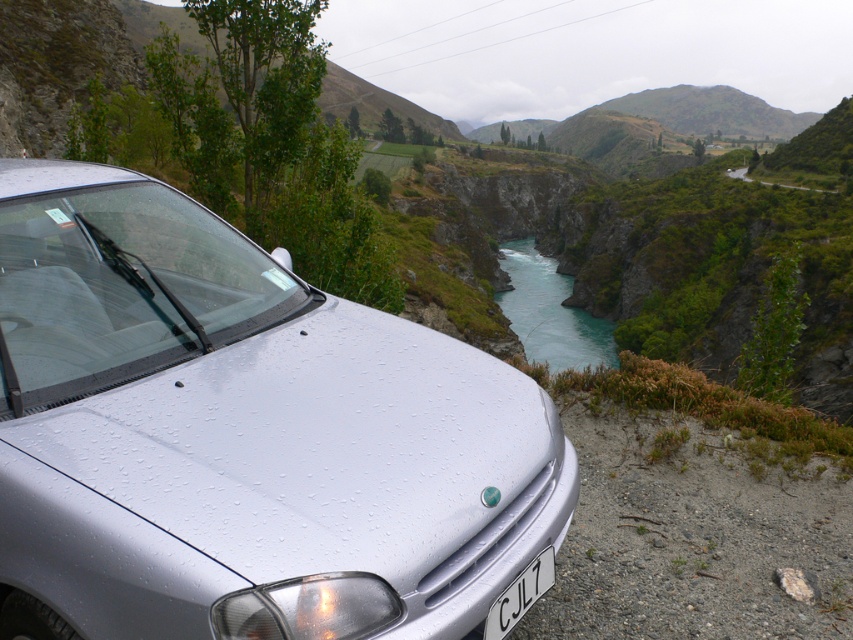
Question: Estimate the real-world distances between objects in this image. Which object is farther from the black plastic license plate at bottom center?

Choices:
 (A) satin silver car at center
 (B) turquoise smooth water at center

Answer: (B)

Question: Can you confirm if satin silver car at center is thinner than turquoise smooth water at center?

Choices:
 (A) no
 (B) yes

Answer: (B)

Question: Which object appears farthest from the camera in this image?

Choices:
 (A) black plastic license plate at bottom center
 (B) satin silver car at center

Answer: (A)

Question: Is satin silver car at center to the left of turquoise smooth water at center from the viewer's perspective?

Choices:
 (A) no
 (B) yes

Answer: (B)

Question: Which of these objects is positioned closest to the satin silver car at center?

Choices:
 (A) turquoise smooth water at center
 (B) black plastic license plate at bottom center

Answer: (B)

Question: Does satin silver car at center have a greater width compared to turquoise smooth water at center?

Choices:
 (A) yes
 (B) no

Answer: (B)